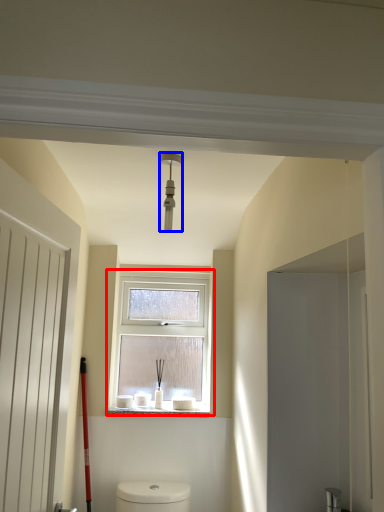
Question: Among these objects, which one is nearest to the camera, window (highlighted by a red box) or light fixture (highlighted by a blue box)?

Choices:
 (A) window
 (B) light fixture

Answer: (B)